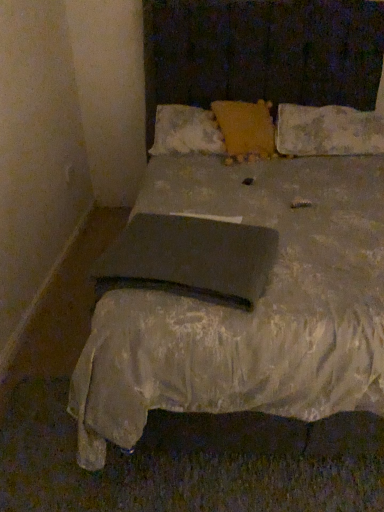
Question: In the image, is yellow textured pillow at center, the first pillow viewed from the left, positioned in front of or behind matte black pad at center?

Choices:
 (A) front
 (B) behind

Answer: (B)

Question: From the image's perspective, is yellow textured pillow at center, which appears as the third pillow when viewed from the right, located above or below matte black pad at center?

Choices:
 (A) below
 (B) above

Answer: (B)

Question: Which object is the closest to the matte black pad at center?

Choices:
 (A) yellow textured pillow at center, the first pillow viewed from the left
 (B) fluffy yellow pillow at center, positioned as the second pillow in right-to-left order
 (C) worn fabric pillow at upper right, positioned as the third pillow in left-to-right order

Answer: (B)

Question: Which object is positioned closest to the fluffy yellow pillow at center, the second pillow viewed from the left?

Choices:
 (A) worn fabric pillow at upper right, positioned as the third pillow in left-to-right order
 (B) yellow textured pillow at center, the first pillow viewed from the left
 (C) matte black pad at center

Answer: (B)